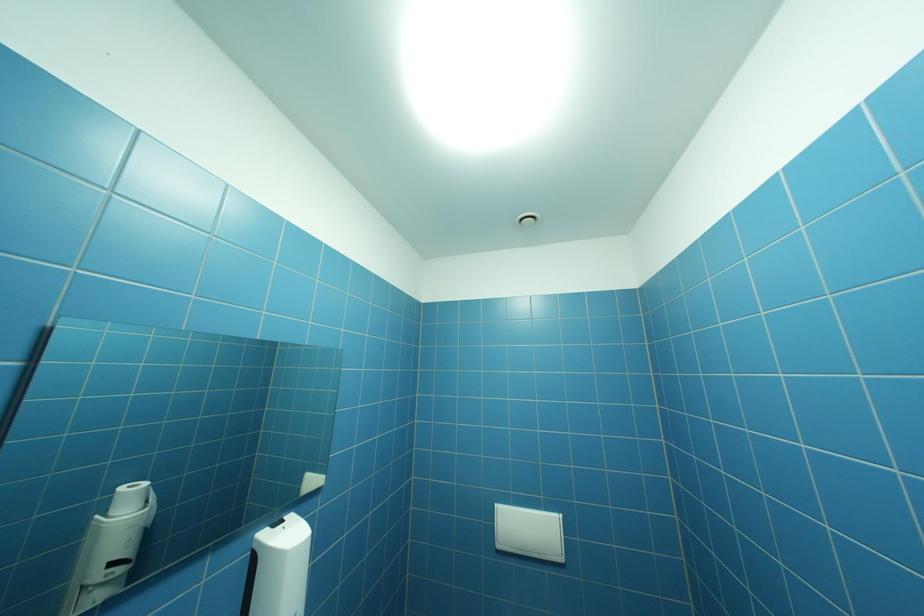
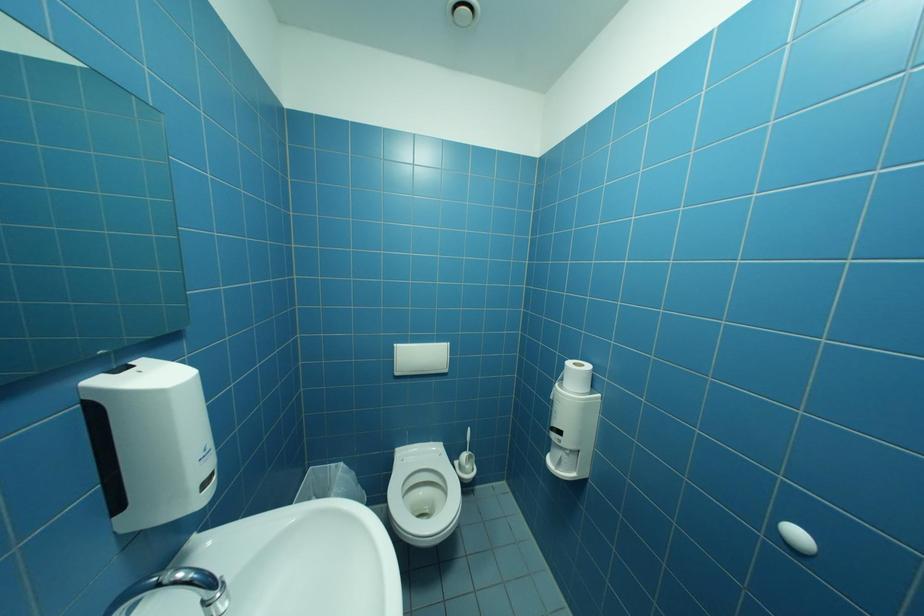
Based on the continuous images, in which direction is the camera rotating?

The rotation direction of the camera is right-down.